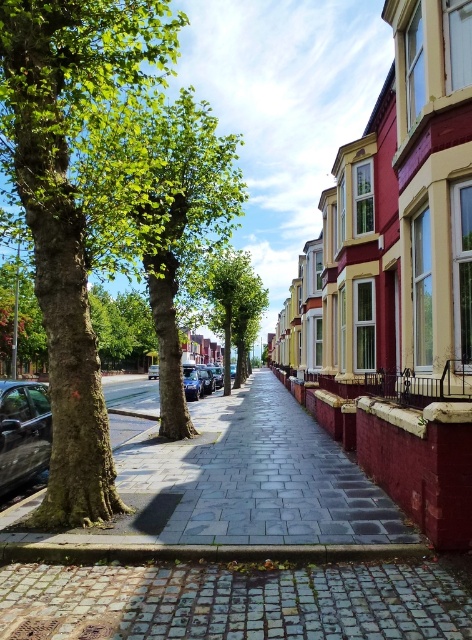
Can you confirm if green leafy tree at center is wider than shiny blue car at center?

No, green leafy tree at center is not wider than shiny blue car at center.

Who is positioned more to the left, green leafy tree at center or shiny blue car at center?

shiny blue car at center

Between point (218, 310) and point (149, 365), which one is positioned behind?

The point (149, 365) is more distant.

You are a GUI agent. You are given a task and a screenshot of the screen. Output one action in this format:
    pyautogui.click(x=<x>, y=<y>)
    Task: Click on the green leafy tree at center
    
    Given the screenshot: What is the action you would take?
    pyautogui.click(x=233, y=305)

From the picture: Is shiny black car at left thinner than shiny metallic car at center?

Yes.

Image resolution: width=472 pixels, height=640 pixels. What do you see at coordinates (23, 432) in the screenshot? I see `shiny black car at left` at bounding box center [23, 432].

Describe the element at coordinates (23, 432) in the screenshot. I see `shiny black car at left` at that location.

I want to click on shiny black car at left, so click(23, 432).

Between green rough bark tree at left and shiny black car at left, which one has less height?

shiny black car at left

Can you confirm if green rough bark tree at left is wider than shiny black car at left?

Correct, the width of green rough bark tree at left exceeds that of shiny black car at left.

This screenshot has width=472, height=640. What do you see at coordinates (70, 204) in the screenshot? I see `green rough bark tree at left` at bounding box center [70, 204].

Find the location of a particular element. green rough bark tree at left is located at coordinates (70, 204).